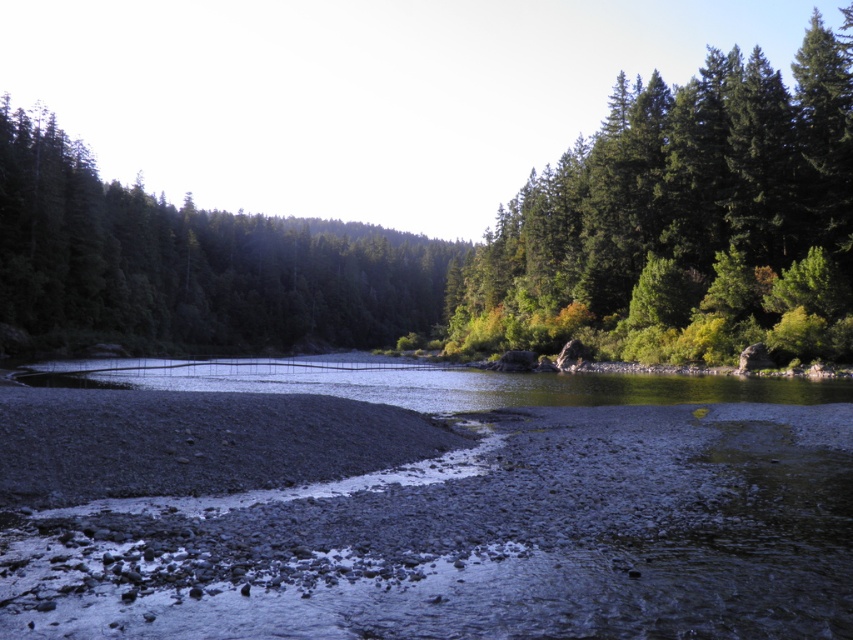
You are standing at the rocky riverbank in the foreground of the image and want to determine which of the two points, point (750,99) or point (769,106), is closer to you. Based on the scene, which point is nearer?

Point (750,99) is closer to the viewer than point (769,106).